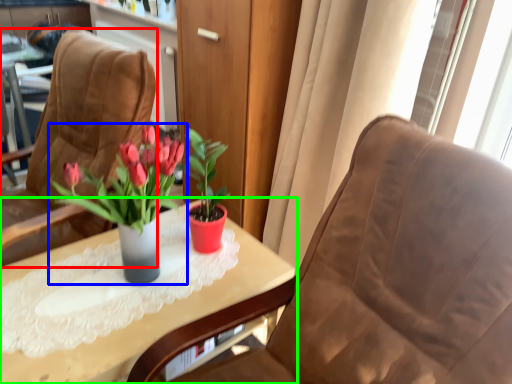
Question: Which object is the closest to the chair (highlighted by a red box)? Choose among these: houseplant (highlighted by a blue box) or table (highlighted by a green box).

Choices:
 (A) houseplant
 (B) table

Answer: (A)